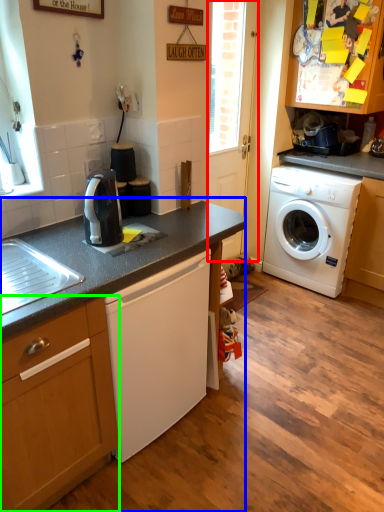
Question: Which object is the closest to the screen door (highlighted by a red box)? Choose among these: countertop (highlighted by a blue box) or cabinetry (highlighted by a green box).

Choices:
 (A) countertop
 (B) cabinetry

Answer: (A)